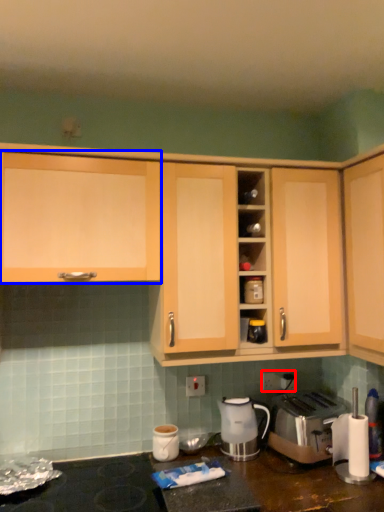
Question: Which object appears farthest to the camera in this image, electric outlet (highlighted by a red box) or cabinetry (highlighted by a blue box)?

Choices:
 (A) electric outlet
 (B) cabinetry

Answer: (A)